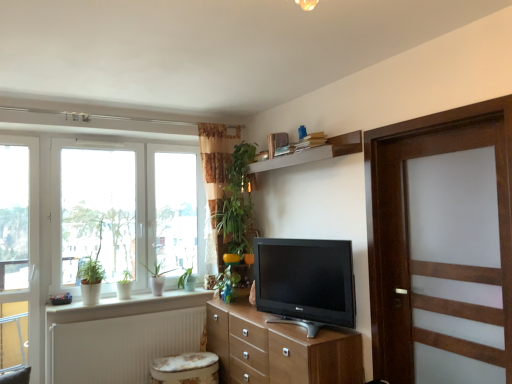
How much space does green glossy plant at left, arranged as the first plant when viewed from the left, occupy vertically?

71.12 centimeters.

This screenshot has height=384, width=512. What do you see at coordinates (95, 255) in the screenshot? I see `green glossy plant at left, which ranks as the 2th plant in right-to-left order` at bounding box center [95, 255].

The height and width of the screenshot is (384, 512). Describe the element at coordinates (19, 251) in the screenshot. I see `transparent glass door at left` at that location.

This screenshot has height=384, width=512. I want to click on white textured radiator at lower left, so coord(120,345).

What do you see at coordinates (226, 283) in the screenshot? This screenshot has width=512, height=384. I see `green glossy plant at center, the first plant positioned from the right` at bounding box center [226, 283].

Image resolution: width=512 pixels, height=384 pixels. I want to click on wooden chest of drawers at center, so click(x=279, y=349).

In the scene shown: From a real-world perspective, is wooden door at right below floral fabric music stool at lower center?

No.

Is floral fabric music stool at lower center at the back of wooden door at right?

No, wooden door at right is not facing away from floral fabric music stool at lower center.

Based on their sizes in the image, would you say wooden door at right is bigger or smaller than floral fabric music stool at lower center?

In the image, wooden door at right appears to be larger than floral fabric music stool at lower center.

Does point (440, 117) come in front of point (179, 378)?

Yes.

Looking at this image, from a real-world perspective, who is located lower, white ceramic pots at lower left or white plastic window at left?

From a 3D spatial view, white ceramic pots at lower left is below.

From the image's perspective, which one is positioned lower, white ceramic pots at lower left or white plastic window at left?

From the image's view, white ceramic pots at lower left is below.

Would you say white ceramic pots at lower left contains white plastic window at left?

No, white plastic window at left is not a part of white ceramic pots at lower left.

Which of these two, transparent glass door at left or wooden shelf at upper center, is bigger?

Bigger between the two is wooden shelf at upper center.

Which object is further away from the camera taking this photo, transparent glass door at left or wooden shelf at upper center?

Positioned behind is transparent glass door at left.

Considering the sizes of objects transparent glass door at left and wooden shelf at upper center in the image provided, who is taller, transparent glass door at left or wooden shelf at upper center?

Standing taller between the two is transparent glass door at left.

Which is in front, point (9, 153) or point (284, 165)?

The point (284, 165) is closer.

Between white textured radiator at lower left and transparent glass door at left, which one is positioned behind?

Positioned behind is transparent glass door at left.

Would you say white textured radiator at lower left is outside transparent glass door at left?

Indeed, white textured radiator at lower left is completely outside transparent glass door at left.

Consider the image. From a real-world perspective, is white textured radiator at lower left physically located above or below transparent glass door at left?

white textured radiator at lower left is below transparent glass door at left.

Who is smaller, white textured radiator at lower left or transparent glass door at left?

With smaller size is transparent glass door at left.

From the picture: Is white textured radiator at lower left with matte black tv at center?

No, white textured radiator at lower left is not beside matte black tv at center.

In the scene shown: Considering their positions, is white textured radiator at lower left located in front of or behind matte black tv at center?

In the image, white textured radiator at lower left appears behind matte black tv at center.

Is white textured radiator at lower left at the right side of matte black tv at center?

No.

Does white textured radiator at lower left turn towards matte black tv at center?

No, white textured radiator at lower left is not turned towards matte black tv at center.

From the image's perspective, which is above, white textured radiator at lower left or green glossy plant at center, which is the 2th plant in left-to-right order?

From the image's view, green glossy plant at center, which is the 2th plant in left-to-right order, is above.

Measure the distance from white textured radiator at lower left to green glossy plant at center, the first plant positioned from the right.

79.02 centimeters.

Where is `plant on the right side of white textured radiator at lower left`? plant on the right side of white textured radiator at lower left is located at coordinates (226, 283).

Considering the sizes of objects white textured radiator at lower left and green glossy plant at center, the first plant positioned from the right, in the image provided, who is shorter, white textured radiator at lower left or green glossy plant at center, the first plant positioned from the right,?

green glossy plant at center, the first plant positioned from the right, is shorter.

From the image's perspective, relative to matte black tv at center, is floral fabric music stool at lower center above or below?

From the image's perspective, floral fabric music stool at lower center appears below matte black tv at center.

Locate an element on the screen. music stool on the left of the matte black tv at center is located at coordinates (186, 369).

Between floral fabric music stool at lower center and matte black tv at center, which one has smaller width?

matte black tv at center.

Are floral fabric music stool at lower center and matte black tv at center located far from each other?

floral fabric music stool at lower center is actually quite close to matte black tv at center.

The width and height of the screenshot is (512, 384). In order to click on music stool that appears below the wooden door at right (from the image's perspective) in this screenshot , I will do `click(186, 369)`.

The width and height of the screenshot is (512, 384). Identify the location of window sill that appears on the right of white plastic window at left. (129, 306).

Looking at the image, which one is located further to white plastic window at left, transparent glass door at left or green glossy plant at center, which is the 2th plant in left-to-right order?

Based on the image, green glossy plant at center, which is the 2th plant in left-to-right order, appears to be further to white plastic window at left.

Which object lies nearer to the anchor point floral fabric music stool at lower center, wooden shelf at upper center or transparent glass door at left?

transparent glass door at left is positioned closer to the anchor floral fabric music stool at lower center.

When comparing their distances from transparent glass door at left, does white ceramic pots at lower left or wooden door at right seem closer?

The object closer to transparent glass door at left is white ceramic pots at lower left.

From the image, which object appears to be nearer to white textured radiator at lower left, transparent glass door at left or white ceramic pots at lower left?

Among the two, white ceramic pots at lower left is located nearer to white textured radiator at lower left.

Estimate the real-world distances between objects in this image. Which object is closer to white plastic window at left, green glossy plant at center, the first plant positioned from the right, or wooden door at right?

The object closer to white plastic window at left is green glossy plant at center, the first plant positioned from the right.

From the image, which object appears to be nearer to green glossy plant at left, which ranks as the 2th plant in right-to-left order, white textured radiator at lower left or white ceramic pots at lower left?

white ceramic pots at lower left is positioned closer to the anchor green glossy plant at left, which ranks as the 2th plant in right-to-left order.

From the image, which object appears to be farther from green glossy plant at left, arranged as the first plant when viewed from the left, matte black tv at center or transparent glass door at left?

matte black tv at center is further to green glossy plant at left, arranged as the first plant when viewed from the left.

Which object lies further to the anchor point white ceramic pots at lower left, floral fabric music stool at lower center or white textured radiator at lower left?

floral fabric music stool at lower center lies further to white ceramic pots at lower left than the other object.

This screenshot has height=384, width=512. I want to click on music stool between white textured radiator at lower left and matte black tv at center in the horizontal direction, so click(186, 369).

Where is `television between wooden shelf at upper center and wooden chest of drawers at center in the up-down direction`? The height and width of the screenshot is (384, 512). television between wooden shelf at upper center and wooden chest of drawers at center in the up-down direction is located at coordinates (305, 282).

Locate an element on the screen. window sill located between green glossy plant at left, arranged as the first plant when viewed from the left, and wooden chest of drawers at center in the left-right direction is located at coordinates (129, 306).

Where is `shelf between green glossy plant at left, arranged as the first plant when viewed from the left, and matte black tv at center, in the horizontal direction`? The height and width of the screenshot is (384, 512). shelf between green glossy plant at left, arranged as the first plant when viewed from the left, and matte black tv at center, in the horizontal direction is located at coordinates (314, 153).